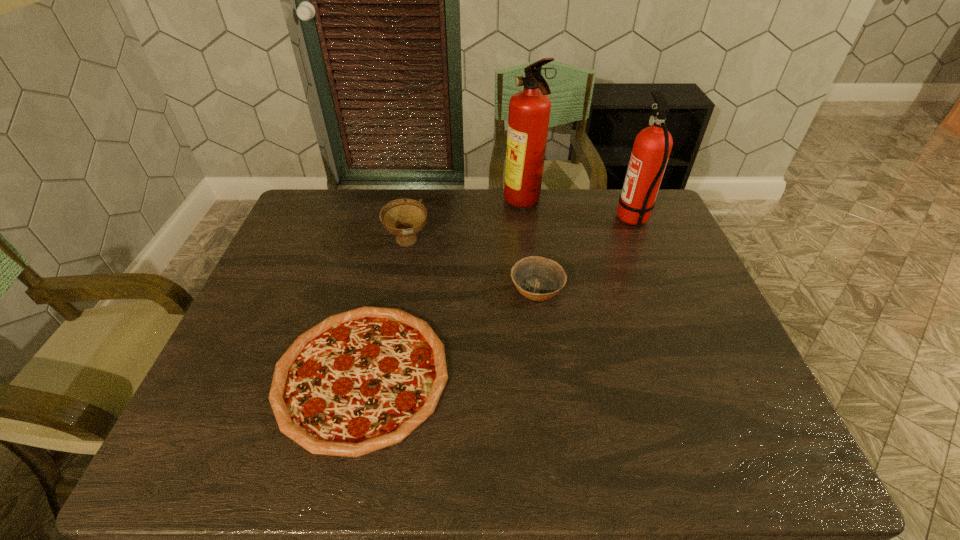
Identify the location of vacant area that lies between the shortest object and the taller fire extinguisher. This screenshot has width=960, height=540. (443, 289).

Where is `free spot between the second tallest object and the left fire extinguisher`? free spot between the second tallest object and the left fire extinguisher is located at coordinates (578, 211).

You are a GUI agent. You are given a task and a screenshot of the screen. Output one action in this format:
    pyautogui.click(x=<x>, y=<y>)
    Task: Click on the vacant point located between the taller fire extinguisher and the third tallest object
    
    Given the screenshot: What is the action you would take?
    pyautogui.click(x=466, y=222)

Identify the location of empty space between the rightmost object and the tallest object. (578, 211).

Identify the location of free spot between the bowl and the shorter fire extinguisher. (585, 254).

You are a GUI agent. You are given a task and a screenshot of the screen. Output one action in this format:
    pyautogui.click(x=<x>, y=<y>)
    Task: Click on the free area in between the second shortest object and the shortest object
    
    Given the screenshot: What is the action you would take?
    pyautogui.click(x=449, y=332)

This screenshot has width=960, height=540. Find the location of `free space between the shorter fire extinguisher and the bowl`. free space between the shorter fire extinguisher and the bowl is located at coordinates pos(585,254).

Where is `the closest object to the third shortest object`? The image size is (960, 540). the closest object to the third shortest object is located at coordinates (362, 380).

This screenshot has height=540, width=960. Identify the location of object identified as the second closest to the taller fire extinguisher. (404, 218).

Find the location of a particular element. The width and height of the screenshot is (960, 540). vacant region that satisfies the following two spatial constraints: 1. on the back side of the shortest object; 2. on the right side of the soup bowl is located at coordinates (392, 242).